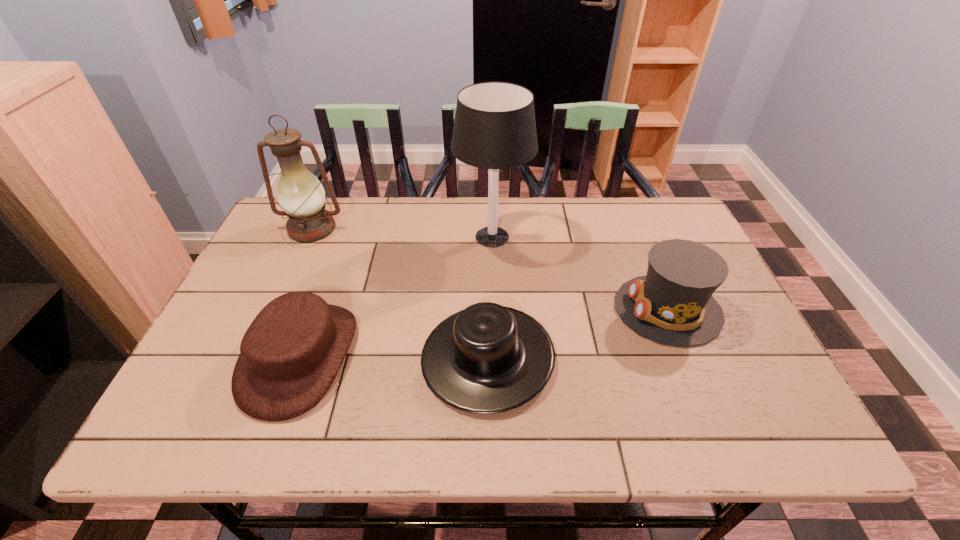
This screenshot has width=960, height=540. Find the location of `table lamp`. table lamp is located at coordinates (494, 128).

I want to click on the second tallest object, so [x=301, y=195].

Locate an element on the screen. the rightmost object is located at coordinates (x=673, y=304).

Locate an element on the screen. This screenshot has width=960, height=540. the tallest hat is located at coordinates (673, 304).

You are a GUI agent. You are given a task and a screenshot of the screen. Output one action in this format:
    pyautogui.click(x=<x>, y=<y>)
    Task: Click on the second hat from right to left
    This screenshot has width=960, height=540.
    Given the screenshot: What is the action you would take?
    pyautogui.click(x=485, y=359)

Where is `the leftmost hat`? This screenshot has height=540, width=960. the leftmost hat is located at coordinates (291, 353).

This screenshot has width=960, height=540. In order to click on vacant area situated on the right of the table lamp in this screenshot , I will do `click(617, 237)`.

Where is `vacant region located 0.050m on the back of the oil lamp`? This screenshot has height=540, width=960. vacant region located 0.050m on the back of the oil lamp is located at coordinates (324, 203).

Locate an element on the screen. The image size is (960, 540). vacant region located 0.110m with goggles on the front of the third tallest object is located at coordinates (570, 309).

This screenshot has width=960, height=540. Find the location of `vacant space situated 0.340m with goggles on the front of the third tallest object`. vacant space situated 0.340m with goggles on the front of the third tallest object is located at coordinates (479, 309).